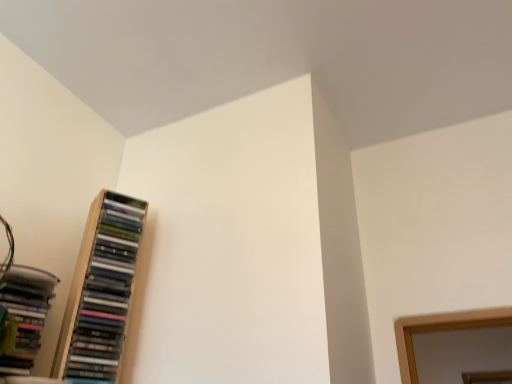
Describe the element at coordinates (100, 291) in the screenshot. This screenshot has height=384, width=512. I see `wooden bookcase at left` at that location.

At what (x,y) coordinates should I click in order to perform the action: click on wooden bookcase at left. Please return your answer as a coordinate pair (x, y). This screenshot has width=512, height=384. Looking at the image, I should click on (100, 291).

The image size is (512, 384). Identify the location of matte black books at left. (26, 314).

What do you see at coordinates (26, 314) in the screenshot? This screenshot has height=384, width=512. I see `matte black books at left` at bounding box center [26, 314].

This screenshot has height=384, width=512. I want to click on wooden bookcase at left, so click(100, 291).

Does matte black books at left appear on the right side of wooden bookcase at left?

No, matte black books at left is not to the right of wooden bookcase at left.

Which object is further away from the camera, matte black books at left or wooden bookcase at left?

wooden bookcase at left.

Which is more distant, (18, 292) or (118, 203)?

The point (118, 203) is more distant.

From the image's perspective, is matte black books at left positioned above or below wooden bookcase at left?

Clearly, from the image's perspective, matte black books at left is below wooden bookcase at left.

From a real-world perspective, is matte black books at left physically located above or below wooden bookcase at left?

From a real-world perspective, matte black books at left is physically below wooden bookcase at left.

Is matte black books at left wider than wooden bookcase at left?

Yes.

Considering the sizes of matte black books at left and wooden bookcase at left in the image, is matte black books at left taller or shorter than wooden bookcase at left?

In the image, matte black books at left appears to be shorter than wooden bookcase at left.

Considering the sizes of objects matte black books at left and wooden bookcase at left in the image provided, who is bigger, matte black books at left or wooden bookcase at left?

Bigger between the two is wooden bookcase at left.

Is wooden bookcase at left surrounded by matte black books at left?

No, wooden bookcase at left is not surrounded by matte black books at left.

Is matte black books at left next to wooden bookcase at left and touching it?

No, matte black books at left is not beside wooden bookcase at left.

In the scene shown: Is matte black books at left facing towards wooden bookcase at left?

No, matte black books at left is not aimed at wooden bookcase at left.

How many degrees apart are the facing directions of matte black books at left and wooden bookcase at left?

The angle between the facing direction of matte black books at left and the facing direction of wooden bookcase at left is 1.82 degrees.

How much distance is there between matte black books at left and wooden bookcase at left?

The distance of matte black books at left from wooden bookcase at left is 5.70 inches.

Locate an element on the screen. bookcase above the matte black books at left (from a real-world perspective) is located at coordinates (100, 291).

Considering the relative positions of wooden bookcase at left and matte black books at left in the image provided, is wooden bookcase at left to the left of matte black books at left from the viewer's perspective?

In fact, wooden bookcase at left is to the right of matte black books at left.

Relative to matte black books at left, is wooden bookcase at left in front or behind?

wooden bookcase at left is behind matte black books at left.

Which point is more distant from viewer, [101,233] or [27,300]?

Point [101,233]

From the image's perspective, between wooden bookcase at left and matte black books at left, who is located below?

matte black books at left, from the image's perspective.

From a real-world perspective, between wooden bookcase at left and matte black books at left, who is vertically higher?

In real-world perspective, wooden bookcase at left is above.

Can you confirm if wooden bookcase at left is thinner than matte black books at left?

Correct, the width of wooden bookcase at left is less than that of matte black books at left.

Based on the photo, who is shorter, wooden bookcase at left or matte black books at left?

With less height is matte black books at left.

Is wooden bookcase at left smaller than matte black books at left?

No.

Do you think wooden bookcase at left is within matte black books at left, or outside of it?

wooden bookcase at left cannot be found inside matte black books at left.

Is wooden bookcase at left far away from matte black books at left?

Actually, wooden bookcase at left and matte black books at left are a little close together.

Is wooden bookcase at left facing away from matte black books at left?

No, wooden bookcase at left's orientation is not away from matte black books at left.

Identify the location of bookcase above the matte black books at left (from a real-world perspective). Image resolution: width=512 pixels, height=384 pixels. (100, 291).

Where is `bookcase positioned vertically above the matte black books at left (from a real-world perspective)`? bookcase positioned vertically above the matte black books at left (from a real-world perspective) is located at coordinates (100, 291).

Where is `book below the wooden bookcase at left (from a real-world perspective)`? This screenshot has width=512, height=384. book below the wooden bookcase at left (from a real-world perspective) is located at coordinates (26, 314).